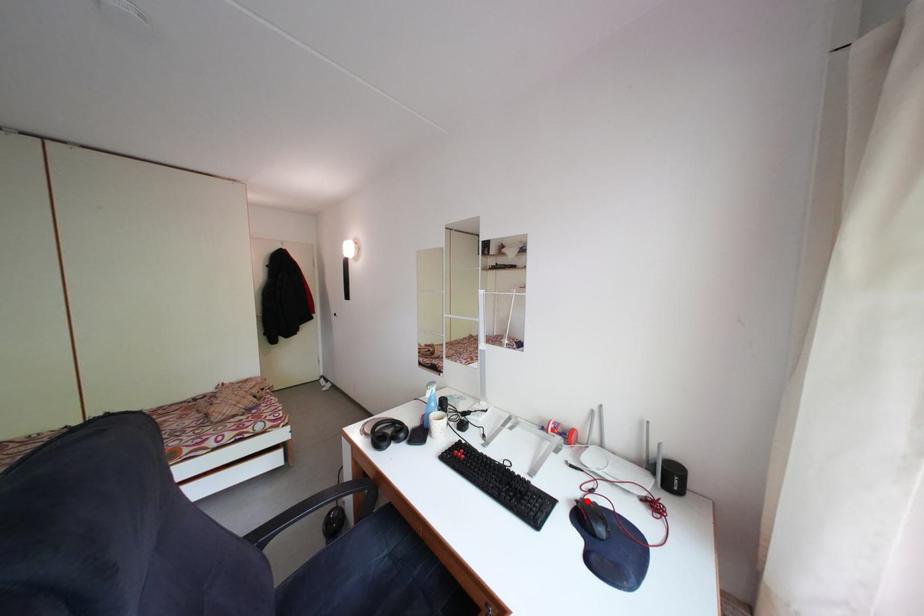
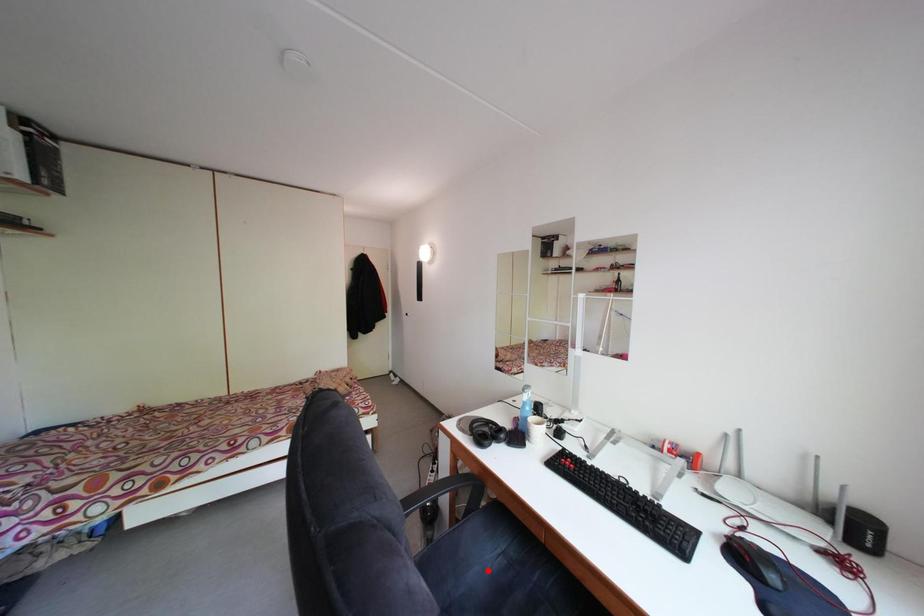
I am providing you with two images of the same scene from different viewpoints. A red point is marked on the first image and another point is marked on the second image. Is the marked point in image1 the same physical position as the marked point in image2?

No